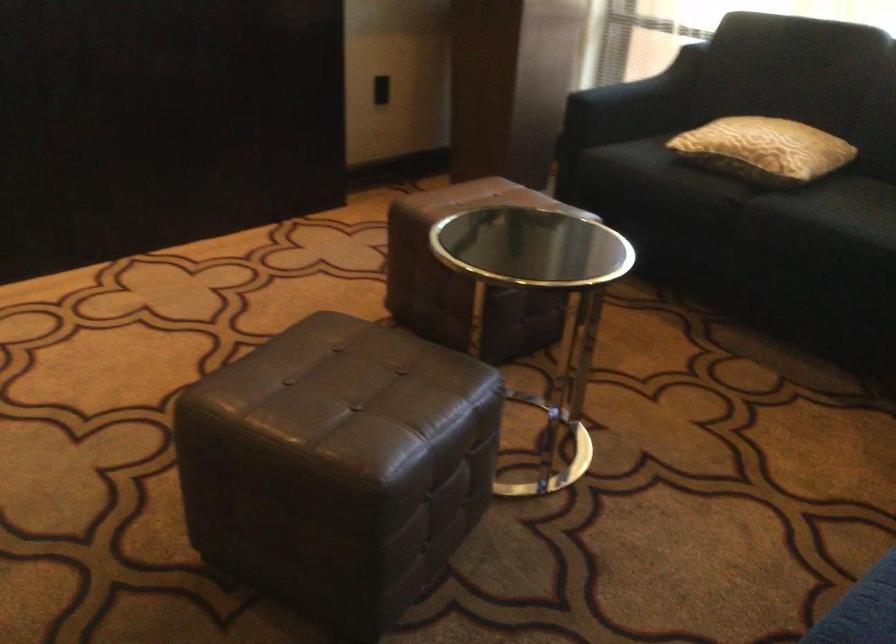
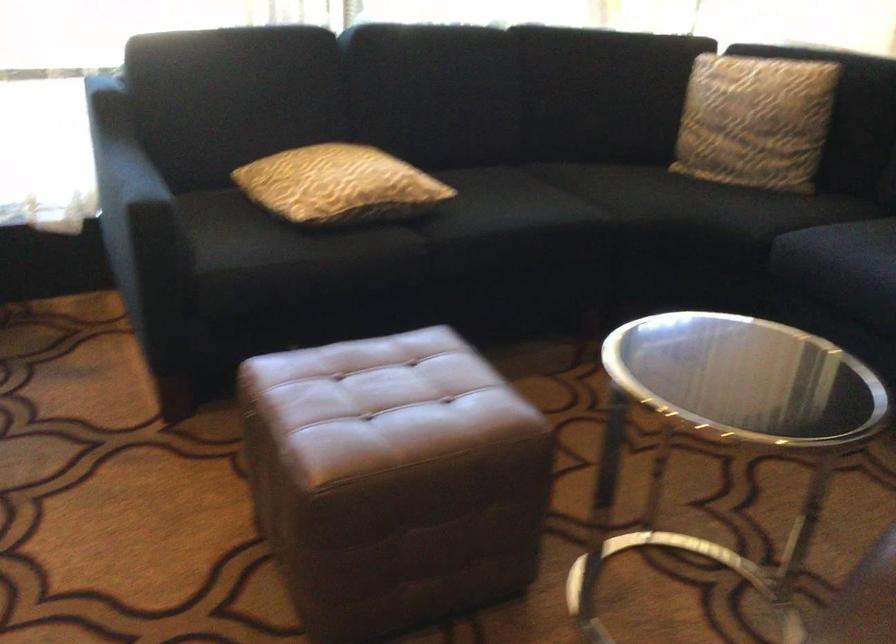
Where in the second image is the point corresponding to point 727,134 from the first image?

(339, 185)